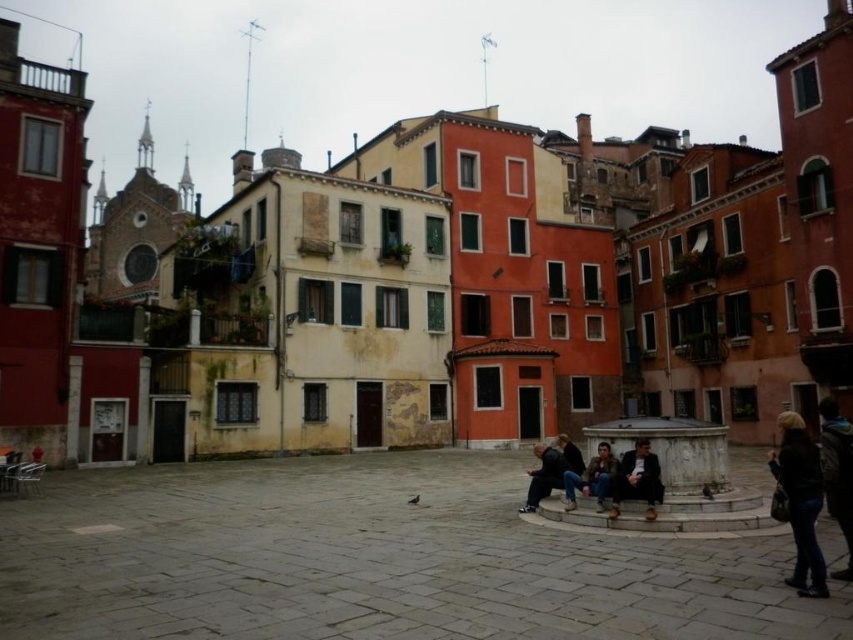
Question: Which object is the closest to the dark brown leather jacket at center?

Choices:
 (A) dark blue jeans at lower right
 (B) leather jacket at center
 (C) matte black jacket at lower center

Answer: (B)

Question: Does dark brown leather jacket at lower right have a larger size compared to matte black jacket at lower center?

Choices:
 (A) yes
 (B) no

Answer: (A)

Question: Can you confirm if dark brown leather jacket at lower right is positioned below dark blue jeans at lower right?

Choices:
 (A) no
 (B) yes

Answer: (B)

Question: Is dark blue jeans at lower right wider than leather jacket at center?

Choices:
 (A) no
 (B) yes

Answer: (B)

Question: Which of these objects is positioned farthest from the dark brown leather jacket at center?

Choices:
 (A) dark blue jeans at lower right
 (B) dark brown leather jacket at lower right

Answer: (A)

Question: Among these objects, which one is nearest to the camera?

Choices:
 (A) leather jacket at center
 (B) dark brown leather jacket at center
 (C) dark brown leather jacket at lower right
 (D) dark blue jeans at lower right

Answer: (C)